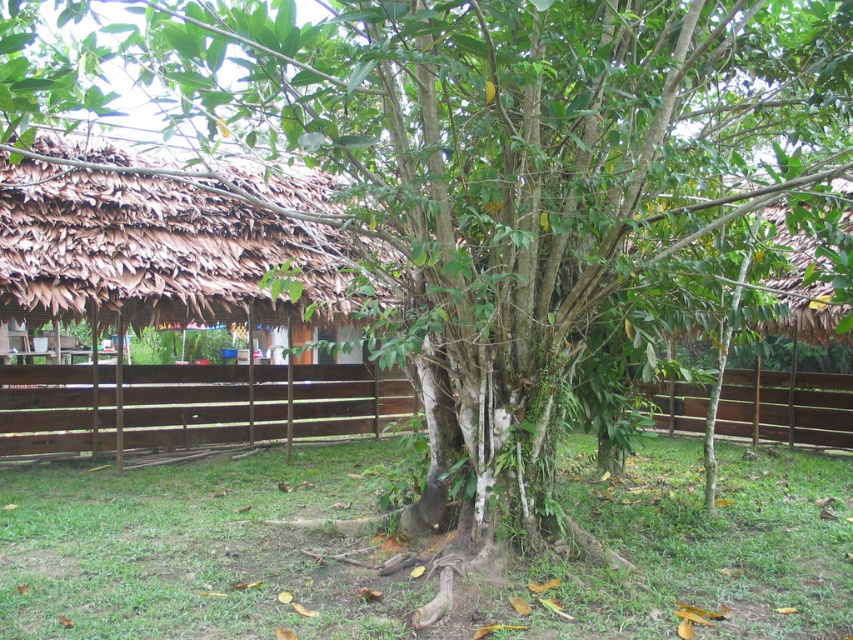
Can you confirm if green grass at center is wider than brown thatch hut at left?

No, green grass at center is not wider than brown thatch hut at left.

Is the position of green grass at center more distant than that of brown thatch hut at left?

No, it is not.

Who is more distant from viewer, [16,556] or [70,312]?

Point [70,312]

I want to click on green grass at center, so click(x=193, y=548).

Between brown thatch hut at left and brown wooden fence at center, which one is positioned higher?

Positioned higher is brown wooden fence at center.

Is brown thatch hut at left to the left of brown wooden fence at center from the viewer's perspective?

Yes, brown thatch hut at left is to the left of brown wooden fence at center.

Which is in front, point (83, 304) or point (125, 385)?

Positioned in front is point (83, 304).

The width and height of the screenshot is (853, 640). I want to click on brown thatch hut at left, so click(x=172, y=316).

Can you confirm if green grass at center is positioned to the right of brown wooden fence at center?

Correct, you'll find green grass at center to the right of brown wooden fence at center.

Between green grass at center and brown wooden fence at center, which one has more height?

brown wooden fence at center is taller.

Which is behind, point (215, 628) or point (115, 417)?

Point (115, 417)

Where is `green grass at center`? green grass at center is located at coordinates (193, 548).